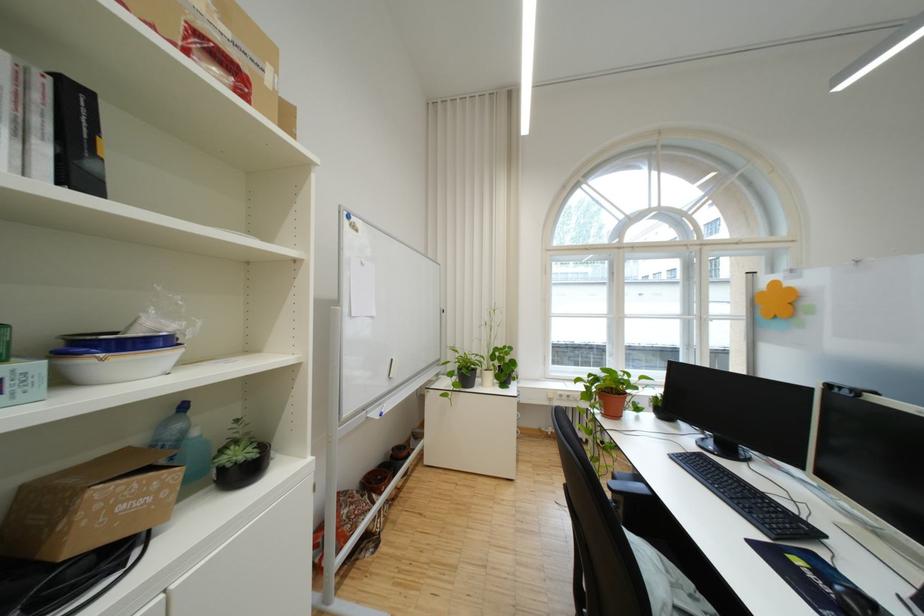
You are a GUI agent. You are given a task and a screenshot of the screen. Output one action in this format:
    pyautogui.click(x=<x>, y=<y>)
    Task: Click on the small potted plant
    The width and height of the screenshot is (924, 616).
    Given the screenshot: What is the action you would take?
    611,391